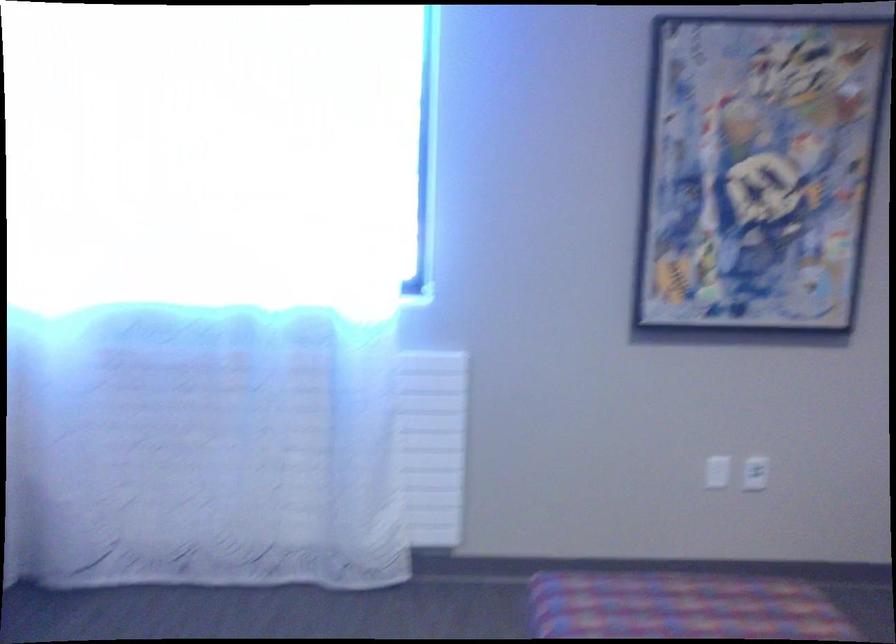
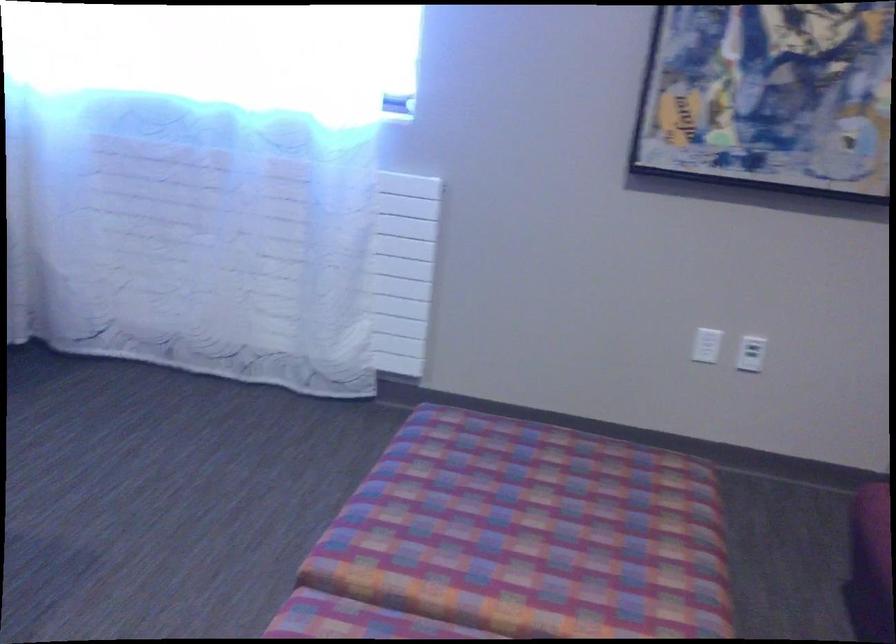
Find the pixel in the second image that matches the point at 721,471 in the first image.

(707, 345)